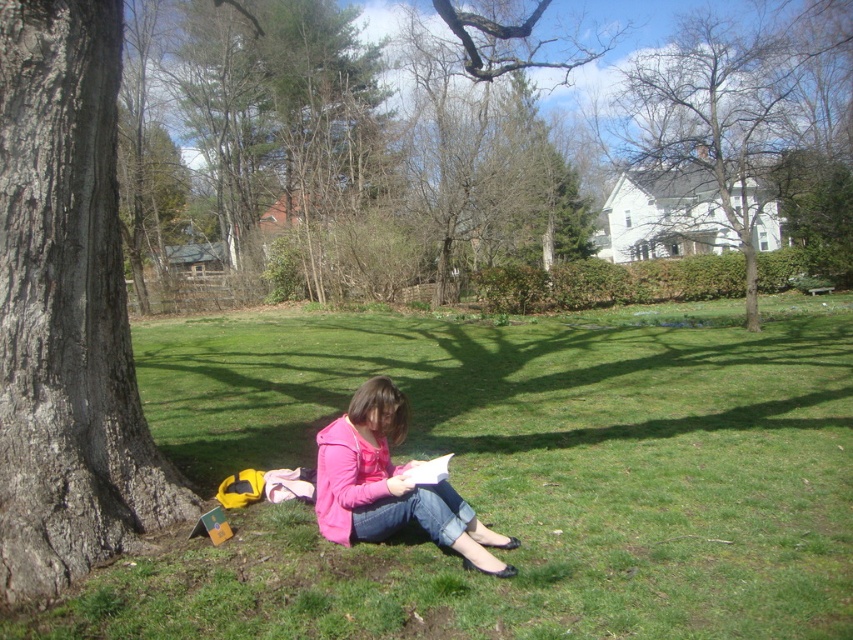
You are standing at the point labeled as point (404, 513) and want to walk towards the point labeled as point (16, 515). According to the scene description, will you be moving towards the foreground or background?

Since point (16, 515) is in front of point (404, 513), moving towards it means you are moving towards the foreground.

You are planning to set up a small picnic blanket in the serene outdoor scene. The green grass at lower left and the gray textured bark at left are both visible. Which area would you choose to place the blanket, and why?

You should place the picnic blanket on the green grass at lower left because it is larger than the gray textured bark at left, providing more space for the blanket.

You are standing at the edge of the grassy area and want to place a 5 feet long wooden bench between the gray textured bark at left and the pink matte jacket at center. Can the bench fit without overlapping either object?

The distance between the gray textured bark at left and the pink matte jacket at center is 4.98 feet. Since the bench is 5 feet long, it cannot fit between them without overlapping one of the objects.